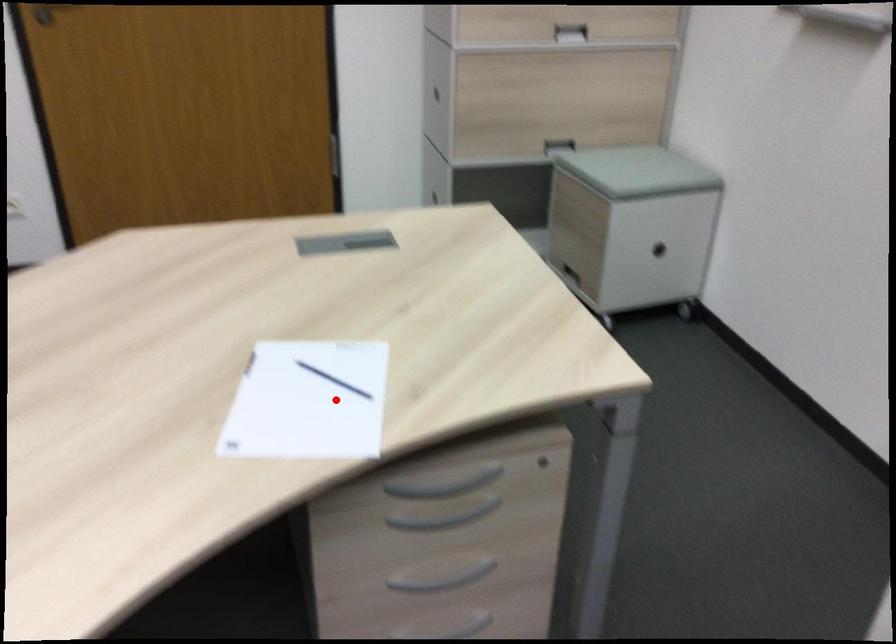
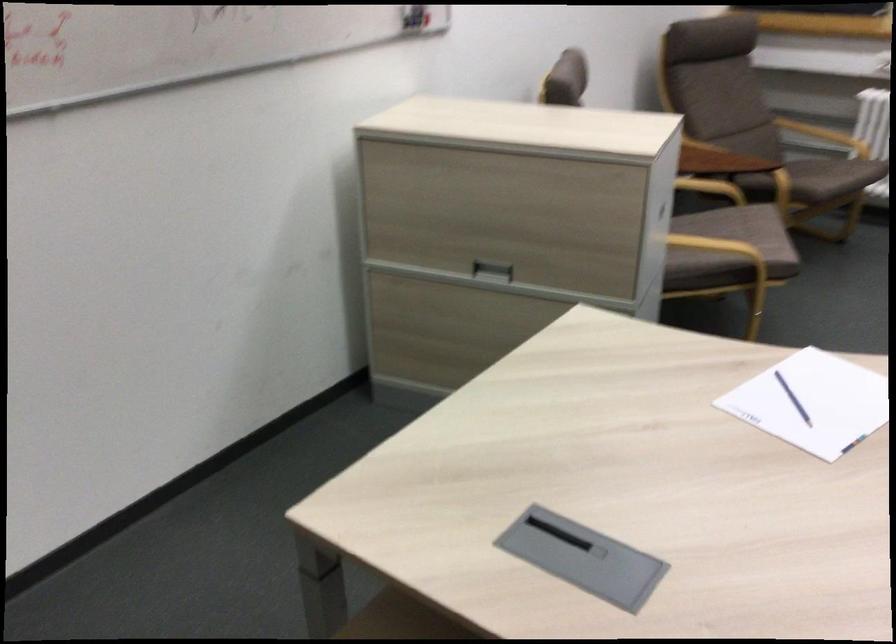
The point at the highlighted location is marked in the first image. Where is the corresponding point in the second image?

(793, 399)